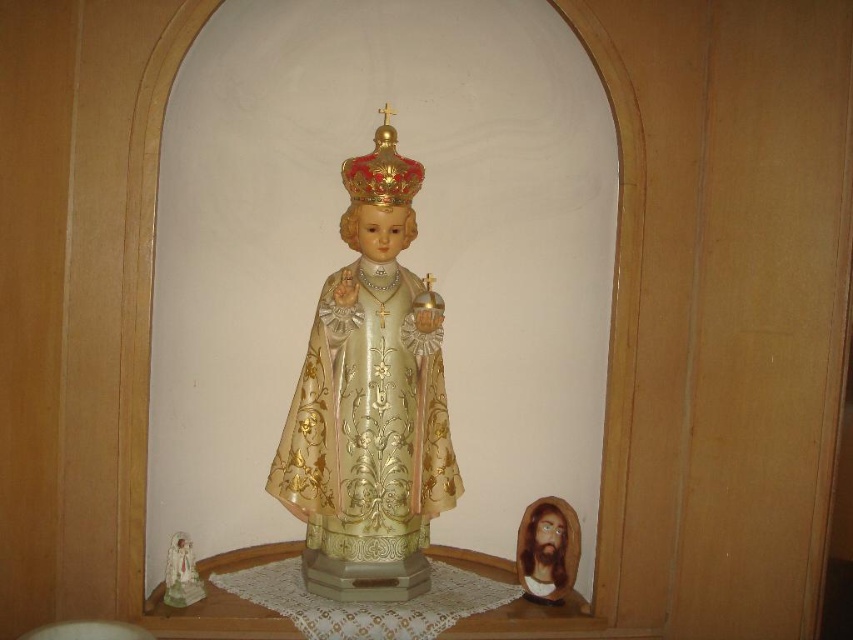
Question: Which point is closer to the camera?

Choices:
 (A) (419, 465)
 (B) (416, 177)
 (C) (518, 561)

Answer: (B)

Question: Does brown wooden head at lower right have a lesser width compared to porcelain statue at center?

Choices:
 (A) no
 (B) yes

Answer: (A)

Question: Does gold glossy statue at center have a greater width compared to brown wooden head at lower right?

Choices:
 (A) no
 (B) yes

Answer: (B)

Question: Does brown wooden head at lower right lie behind porcelain statue at center?

Choices:
 (A) no
 (B) yes

Answer: (B)

Question: Considering the real-world distances, which object is farthest from the brown wooden head at lower right?

Choices:
 (A) porcelain statue at center
 (B) gold glossy statue at center

Answer: (A)

Question: Which point appears farthest from the camera in this image?

Choices:
 (A) (383, 176)
 (B) (190, 554)
 (C) (399, 556)
 (D) (538, 502)

Answer: (D)